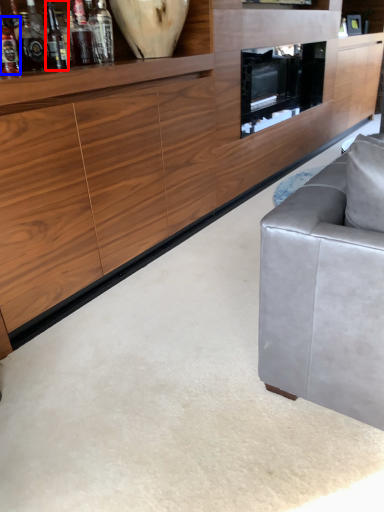
Question: Among these objects, which one is nearest to the camera, wine bottle (highlighted by a red box) or bottle (highlighted by a blue box)?

Choices:
 (A) wine bottle
 (B) bottle

Answer: (A)